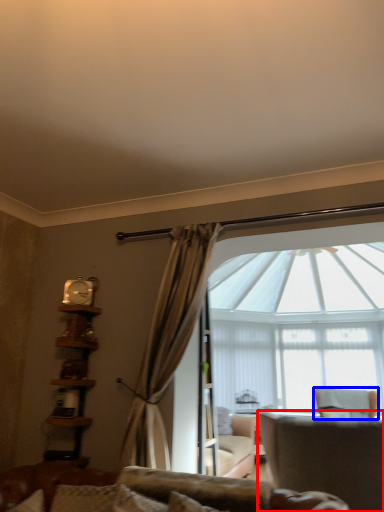
Question: Among these objects, which one is farthest to the camera, chair (highlighted by a red box) or chair (highlighted by a blue box)?

Choices:
 (A) chair
 (B) chair

Answer: (B)